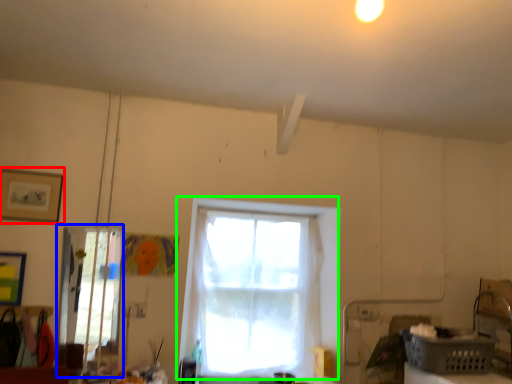
Question: Estimate the real-world distances between objects in this image. Which object is farther from picture frame (highlighted by a red box), glass door (highlighted by a blue box) or window (highlighted by a green box)?

Choices:
 (A) glass door
 (B) window

Answer: (B)